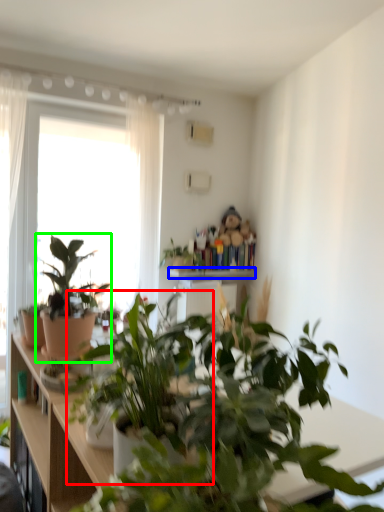
Question: Which is nearer to the houseplant (highlighted by a red box)? window sill (highlighted by a blue box) or houseplant (highlighted by a green box).

Choices:
 (A) window sill
 (B) houseplant

Answer: (B)